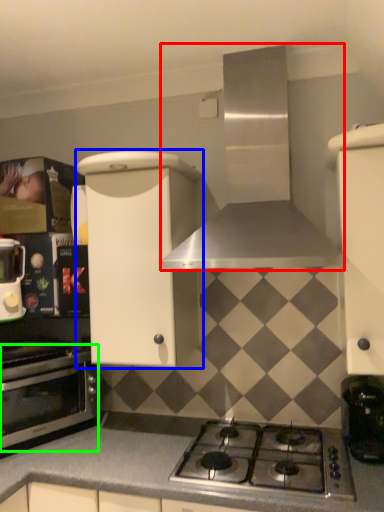
Question: Which object is the farthest from home appliance (highlighted by a red box)? Choose among these: cabinetry (highlighted by a blue box) or oven (highlighted by a green box).

Choices:
 (A) cabinetry
 (B) oven

Answer: (B)